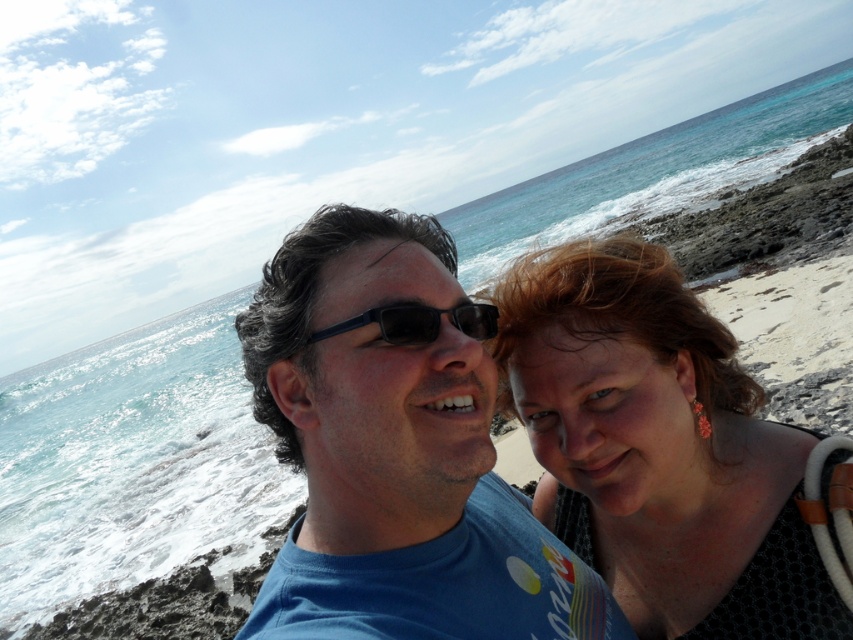
You are a photographer adjusting the focus on a camera. You need to ensure that both the blue matte shirt at center and the matte black hair at center are in sharp focus. Given that the camera has a depth of field that can cover objects within a 15 inch range, will both elements be in focus?

The blue matte shirt at center is 15.29 inches away from the matte black hair at center. Since the distance between them exceeds the camera depth of field range of 15 inches, both elements may not be in focus simultaneously.

You are a photographer analyzing the composition of this coastal selfie. The blue matte shirt at center and the matte black hair at center are both central elements. Based on their positions in the frame, which object occupies more vertical space?

The blue matte shirt at center has a greater height compared to the matte black hair at center, so it occupies more vertical space in the frame.